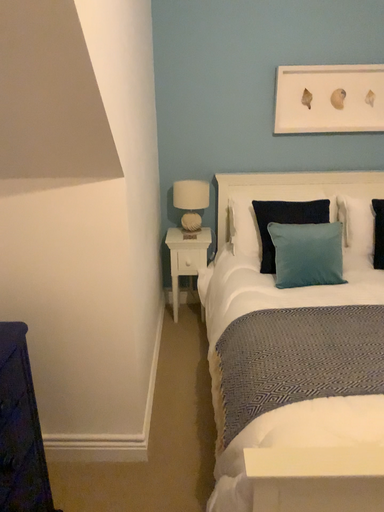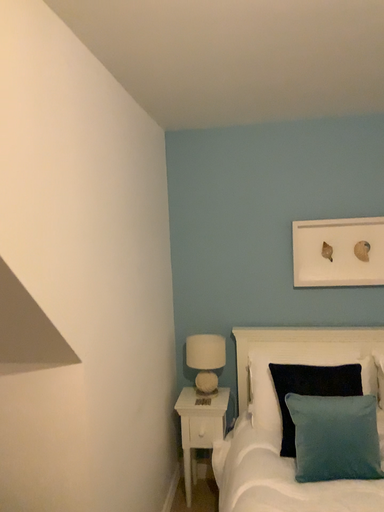
Question: Which way did the camera rotate in the video?

Choices:
 (A) rotated left
 (B) rotated right

Answer: (A)